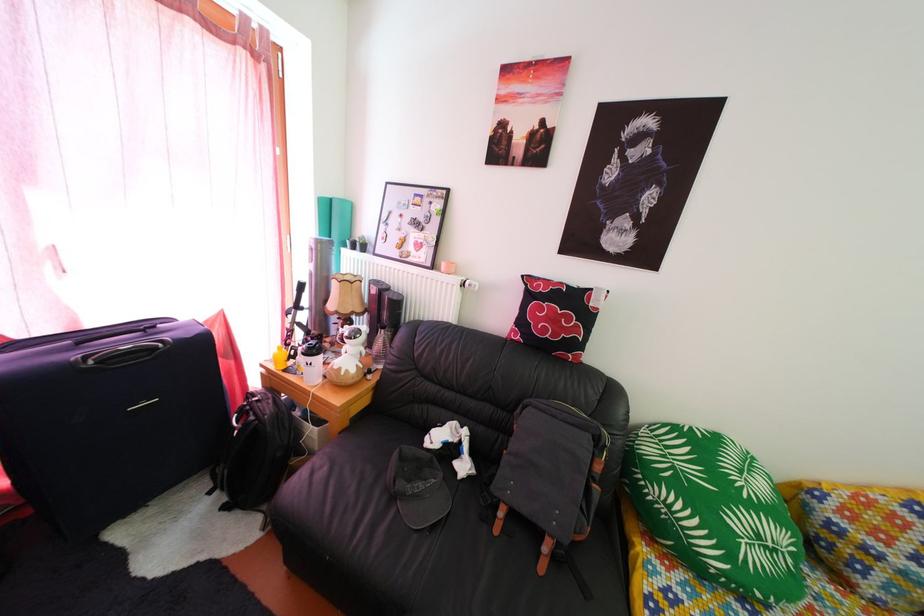
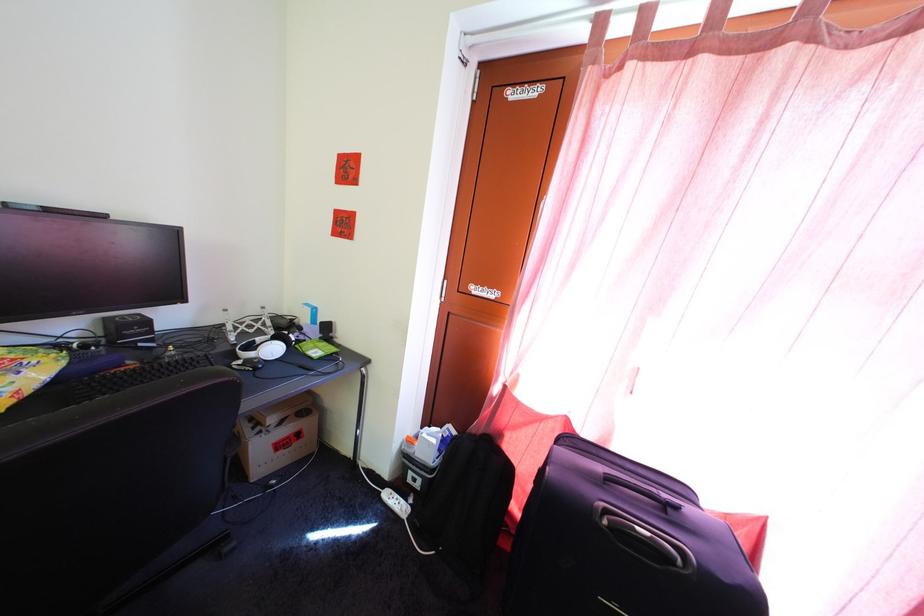
Question: The first image is from the beginning of the video and the second image is from the end. How did the camera likely rotate when shooting the video?

Choices:
 (A) Left
 (B) Right
 (C) Up
 (D) Down

Answer: (A)